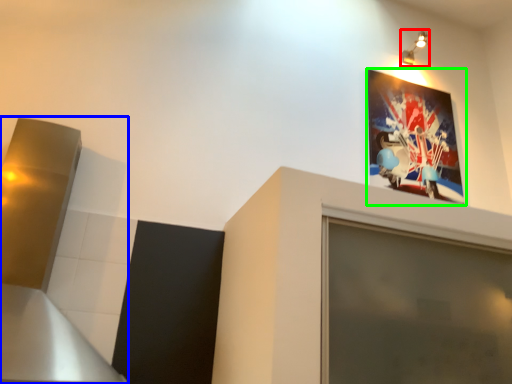
Question: Which is nearer to the light fixture (highlighted by a red box)? exhaust hood (highlighted by a blue box) or picture frame (highlighted by a green box).

Choices:
 (A) exhaust hood
 (B) picture frame

Answer: (B)